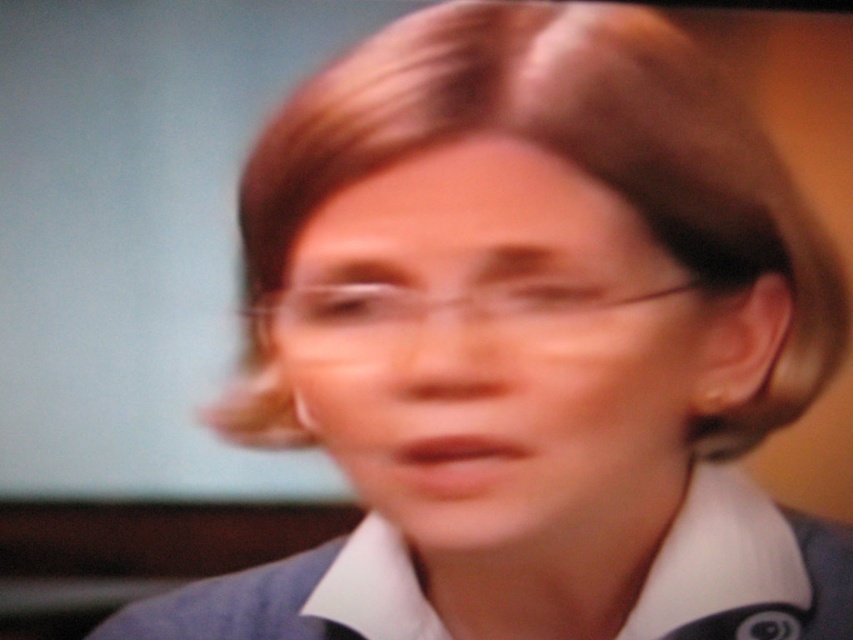
You are a photographer checking the lighting setup for a portrait shoot. You notice the matte plastic face at center and the clear plastic glasses at center in the image. Which object should you adjust to ensure proper lighting on the subject?

The clear plastic glasses at center should be adjusted because they are positioned above the matte plastic face at center and may cause reflections or uneven lighting.

You are designing a 3D model of the scene and need to ensure the proportions are accurate. Given that the clear plastic glasses at center are part of the matte plastic face at center, which object should you scale first to maintain proper proportions?

The clear plastic glasses at center should be scaled first since the matte plastic face at center is much taller than the clear plastic glasses at center, ensuring the glasses fit proportionally on the face.